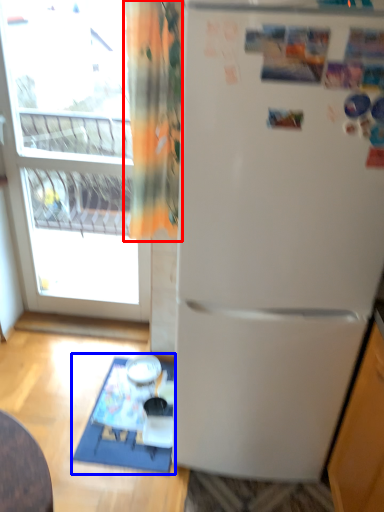
Question: Which of the following is the closest to the observer, curtain (highlighted by a red box) or table (highlighted by a blue box)?

Choices:
 (A) curtain
 (B) table

Answer: (A)